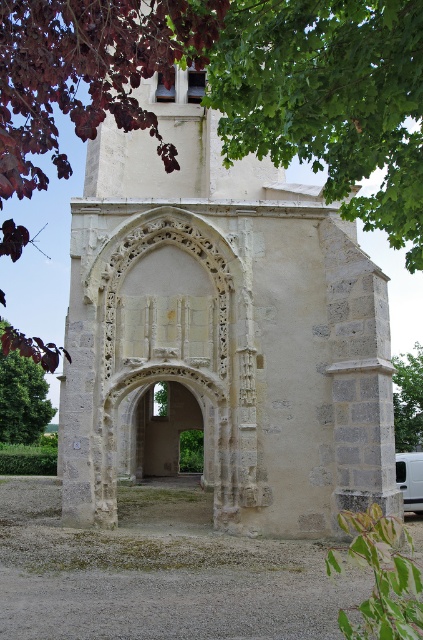
Describe the element at coordinates (220, 333) in the screenshot. I see `stone archway at center` at that location.

Is stone archway at center taller than green leafy tree at lower left?

Correct, stone archway at center is much taller as green leafy tree at lower left.

Does point (147, 292) come in front of point (14, 417)?

Yes, it is in front of point (14, 417).

What are the coordinates of `stone archway at center` in the screenshot? It's located at (220, 333).

Between green leafy tree at lower left and green leafy tree at right, which one appears on the left side from the viewer's perspective?

From the viewer's perspective, green leafy tree at lower left appears more on the left side.

Is point (10, 413) positioned in front of point (422, 440)?

No, (10, 413) is further to viewer.

This screenshot has width=423, height=640. What do you see at coordinates (21, 397) in the screenshot? I see `green leafy tree at lower left` at bounding box center [21, 397].

Where is `green leafy tree at lower left`? The image size is (423, 640). green leafy tree at lower left is located at coordinates (21, 397).

Image resolution: width=423 pixels, height=640 pixels. Describe the element at coordinates (21, 397) in the screenshot. I see `green leafy tree at lower left` at that location.

Consider the image. Who is shorter, green leafy tree at lower left or white matte van at right?

Standing shorter between the two is white matte van at right.

I want to click on green leafy tree at lower left, so click(21, 397).

This screenshot has width=423, height=640. In order to click on green leafy tree at lower left in this screenshot , I will do `click(21, 397)`.